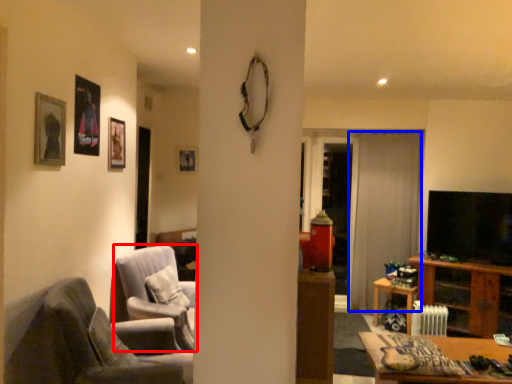
Question: Which object is further to the camera taking this photo, chair (highlighted by a red box) or curtain (highlighted by a blue box)?

Choices:
 (A) chair
 (B) curtain

Answer: (B)